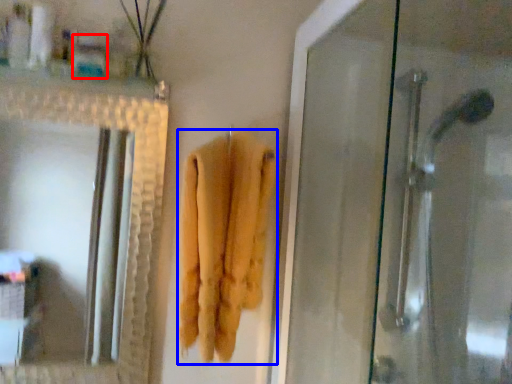
Question: Which of the following is the farthest to the observer, toiletry (highlighted by a red box) or towel (highlighted by a blue box)?

Choices:
 (A) toiletry
 (B) towel

Answer: (A)